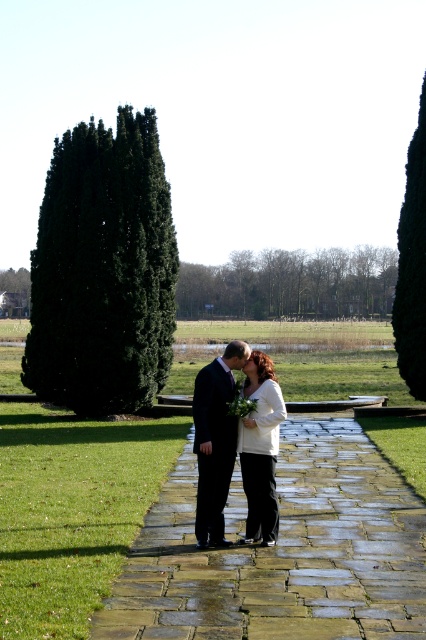
Question: Where is dark green coniferous tree at left located in relation to shiny black suit at center in the image?

Choices:
 (A) below
 (B) above

Answer: (B)

Question: Among these points, which one is nearest to the camera?

Choices:
 (A) (267, 436)
 (B) (149, 204)

Answer: (A)

Question: Can you confirm if green leafy tree at center is thinner than dark green leafy tree at right?

Choices:
 (A) no
 (B) yes

Answer: (A)

Question: Estimate the real-world distances between objects in this image. Which object is farther from the stone paved walkway at center?

Choices:
 (A) dark green leafy tree at right
 (B) shiny black suit at center
 (C) dark green coniferous tree at left

Answer: (A)

Question: Which point is farther to the camera?

Choices:
 (A) (379, 532)
 (B) (215, 273)
 (C) (241, 540)

Answer: (B)

Question: Observing the image, what is the correct spatial positioning of green leafy tree at center in reference to white matte dress at center?

Choices:
 (A) below
 (B) above

Answer: (B)